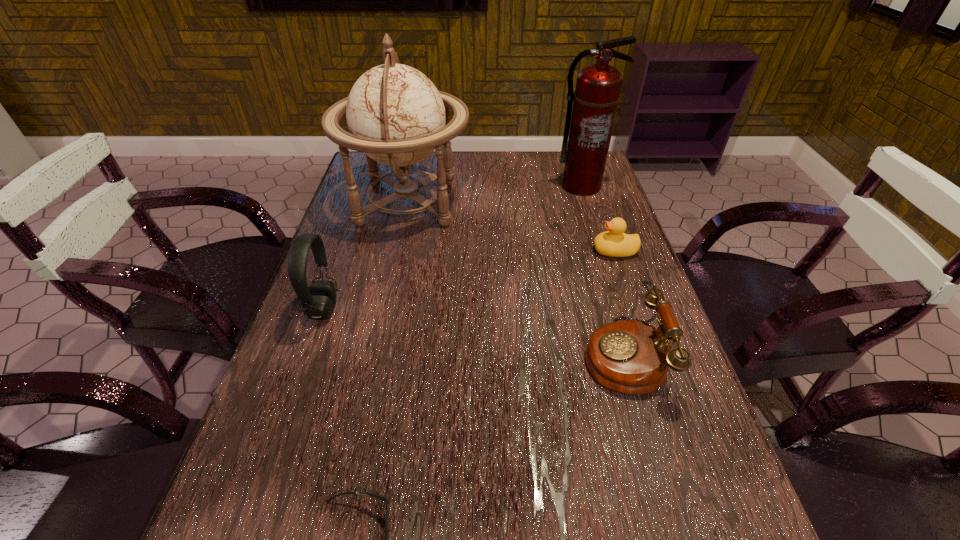
In order to click on vacant space positioned on the dial of the fourth tallest object in this screenshot , I will do `click(449, 354)`.

Where is `blank space located on the dial of the fourth tallest object`? This screenshot has width=960, height=540. blank space located on the dial of the fourth tallest object is located at coordinates (439, 354).

This screenshot has width=960, height=540. In order to click on free space located on the face of the duck in this screenshot , I will do `click(569, 251)`.

Where is `free space located 0.340m on the face of the duck`? free space located 0.340m on the face of the duck is located at coordinates (460, 251).

What are the coordinates of `vacant space located on the face of the duck` in the screenshot? It's located at (558, 251).

The height and width of the screenshot is (540, 960). Find the location of `globe that is positioned at the far edge`. globe that is positioned at the far edge is located at coordinates (396, 116).

You are a GUI agent. You are given a task and a screenshot of the screen. Output one action in this format:
    pyautogui.click(x=<x>, y=<y>)
    Task: Click on the fire extinguisher that is positioned at the far edge
    
    Given the screenshot: What is the action you would take?
    pyautogui.click(x=597, y=93)

The height and width of the screenshot is (540, 960). Find the location of `globe positioned at the left edge`. globe positioned at the left edge is located at coordinates (396, 116).

Where is `headset located at the left edge`? This screenshot has height=540, width=960. headset located at the left edge is located at coordinates (318, 299).

Image resolution: width=960 pixels, height=540 pixels. I want to click on fire extinguisher that is at the right edge, so click(x=597, y=93).